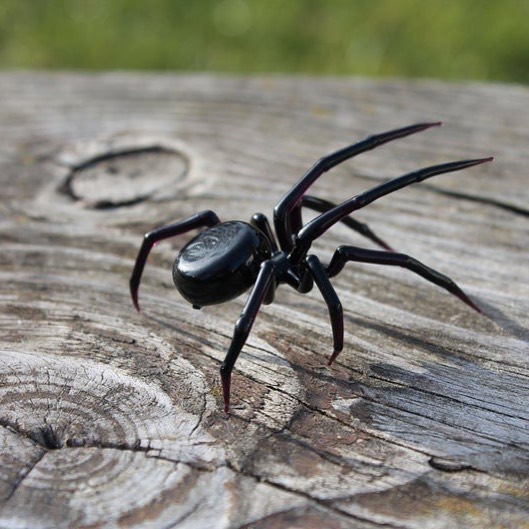
This screenshot has width=529, height=529. Find the location of `wood grain`. wood grain is located at coordinates (469, 232), (54, 279).